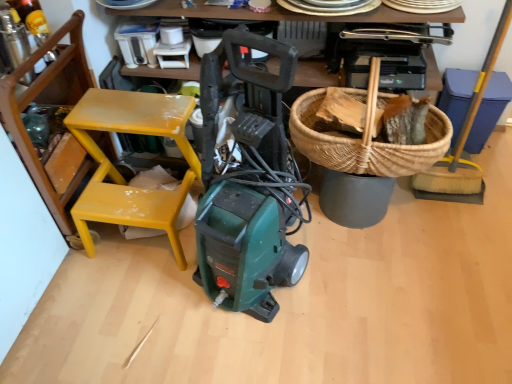
This screenshot has height=384, width=512. Find the location of `woven brown basket at upper right`. woven brown basket at upper right is located at coordinates (365, 145).

The image size is (512, 384). Describe the element at coordinates (118, 171) in the screenshot. I see `yellow painted wood chair at left` at that location.

Identify the location of woven brown basket at upper right. (365, 145).

From the picture: Is yellow painted wood chair at left located outside woven brown basket at upper right?

That's correct, yellow painted wood chair at left is outside of woven brown basket at upper right.

Which is behind, point (181, 109) or point (345, 161)?

The point (181, 109) is more distant.

Image resolution: width=512 pixels, height=384 pixels. Find the location of `basket above the yellow painted wood chair at left (from a real-world perspective)`. basket above the yellow painted wood chair at left (from a real-world perspective) is located at coordinates (365, 145).

Can you confirm if woven brown basket at upper right is bigger than yellow painted wood chair at left?

Actually, woven brown basket at upper right might be smaller than yellow painted wood chair at left.

Where is `chair that is on the left side of woven brown basket at upper right`? chair that is on the left side of woven brown basket at upper right is located at coordinates (118, 171).

From a real-world perspective, is woven brown basket at upper right below yellow painted wood chair at left?

Actually, woven brown basket at upper right is physically above yellow painted wood chair at left in the real world.

Considering the points (423, 151) and (161, 200), which point is in front, point (423, 151) or point (161, 200)?

The point (423, 151) is more forward.

Considering the positions of objects yellow painted wood chair at left and yellow-bristled broom at right in the image provided, who is in front, yellow painted wood chair at left or yellow-bristled broom at right?

yellow painted wood chair at left is in front.

Is yellow painted wood chair at left touching yellow-bristled broom at right?

No, yellow painted wood chair at left is not with yellow-bristled broom at right.

Is yellow painted wood chair at left facing away from yellow-bristled broom at right?

yellow painted wood chair at left is not turned away from yellow-bristled broom at right.

From the image's perspective, who appears lower, yellow painted wood chair at left or yellow-bristled broom at right?

yellow painted wood chair at left, from the image's perspective.

Based on their sizes in the image, would you say yellow-bristled broom at right is bigger or smaller than yellow painted wood chair at left?

Considering their sizes, yellow-bristled broom at right takes up less space than yellow painted wood chair at left.

Which object is positioned more to the right, yellow-bristled broom at right or yellow painted wood chair at left?

Positioned to the right is yellow-bristled broom at right.

Where is `shovel on the right of yellow painted wood chair at left`? This screenshot has height=384, width=512. shovel on the right of yellow painted wood chair at left is located at coordinates (465, 132).

Can you tell me how much yellow-bristled broom at right and yellow painted wood chair at left differ in facing direction?

yellow-bristled broom at right and yellow painted wood chair at left are facing 4.8 degrees away from each other.

Is yellow-bristled broom at right at the back of woven brown basket at upper right?

That's not correct — woven brown basket at upper right is not looking away from yellow-bristled broom at right.

From a real-world perspective, is woven brown basket at upper right located higher than yellow-bristled broom at right?

Yes, from a real-world perspective, woven brown basket at upper right is over yellow-bristled broom at right

Considering the points (426, 147) and (464, 141), which point is behind, point (426, 147) or point (464, 141)?

Positioned behind is point (464, 141).

In terms of height, does woven brown basket at upper right look taller or shorter compared to yellow-bristled broom at right?

Considering their sizes, woven brown basket at upper right has less height than yellow-bristled broom at right.

What's the angular difference between yellow-bristled broom at right and woven brown basket at upper right's facing directions?

5.37 degrees separate the facing orientations of yellow-bristled broom at right and woven brown basket at upper right.

Considering the relative sizes of yellow-bristled broom at right and woven brown basket at upper right in the image provided, is yellow-bristled broom at right bigger than woven brown basket at upper right?

Indeed, yellow-bristled broom at right has a larger size compared to woven brown basket at upper right.

Are yellow-bristled broom at right and woven brown basket at upper right making contact?

No, yellow-bristled broom at right is not in contact with woven brown basket at upper right.

Between point (415, 181) and point (317, 151), which one is positioned in front?

Point (317, 151)

Where is `basket located on the right of yellow painted wood chair at left`? The width and height of the screenshot is (512, 384). basket located on the right of yellow painted wood chair at left is located at coordinates (365, 145).

Image resolution: width=512 pixels, height=384 pixels. Identify the location of chair located underneath the woven brown basket at upper right (from a real-world perspective). (118, 171).

Based on their spatial positions, is yellow-bristled broom at right or woven brown basket at upper right further from yellow painted wood chair at left?

Based on the image, yellow-bristled broom at right appears to be further to yellow painted wood chair at left.

Which object lies nearer to the anchor point woven brown basket at upper right, yellow painted wood chair at left or yellow-bristled broom at right?

yellow-bristled broom at right lies closer to woven brown basket at upper right than the other object.

Based on their spatial positions, is yellow-bristled broom at right or yellow painted wood chair at left further from woven brown basket at upper right?

The object further to woven brown basket at upper right is yellow painted wood chair at left.

Estimate the real-world distances between objects in this image. Which object is further from yellow painted wood chair at left, woven brown basket at upper right or yellow-bristled broom at right?

yellow-bristled broom at right lies further to yellow painted wood chair at left than the other object.

Based on their spatial positions, is yellow painted wood chair at left or woven brown basket at upper right closer to yellow-bristled broom at right?

woven brown basket at upper right lies closer to yellow-bristled broom at right than the other object.

Looking at the image, which one is located closer to yellow-bristled broom at right, woven brown basket at upper right or yellow painted wood chair at left?

The object closer to yellow-bristled broom at right is woven brown basket at upper right.

The image size is (512, 384). I want to click on basket situated between yellow painted wood chair at left and yellow-bristled broom at right from left to right, so click(x=365, y=145).